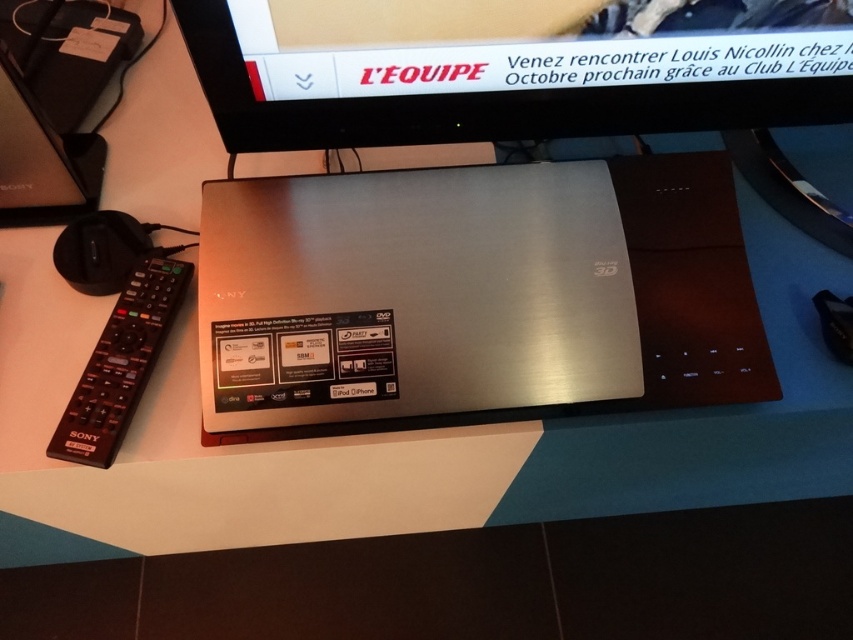
The image size is (853, 640). What do you see at coordinates (485, 298) in the screenshot?
I see `satin silver laptop at center` at bounding box center [485, 298].

Does point (550, 276) come closer to viewer compared to point (694, 0)?

No, it is behind (694, 0).

Identify the location of satin silver laptop at center. The height and width of the screenshot is (640, 853). (485, 298).

Between satin silver laptop at center and black plastic remote at left, which one is positioned lower?

black plastic remote at left

Based on the photo, which is more to the left, satin silver laptop at center or black plastic remote at left?

black plastic remote at left

Locate an element on the screen. This screenshot has width=853, height=640. satin silver laptop at center is located at coordinates (485, 298).

This screenshot has height=640, width=853. What are the coordinates of `satin silver laptop at center` in the screenshot? It's located at (485, 298).

Is satin silver monitor at upper center smaller than black plastic remote at left?

No, satin silver monitor at upper center is not smaller than black plastic remote at left.

Is point (254, 90) behind point (141, 316)?

No, it is not.

Find the location of a particular element. satin silver monitor at upper center is located at coordinates (511, 67).